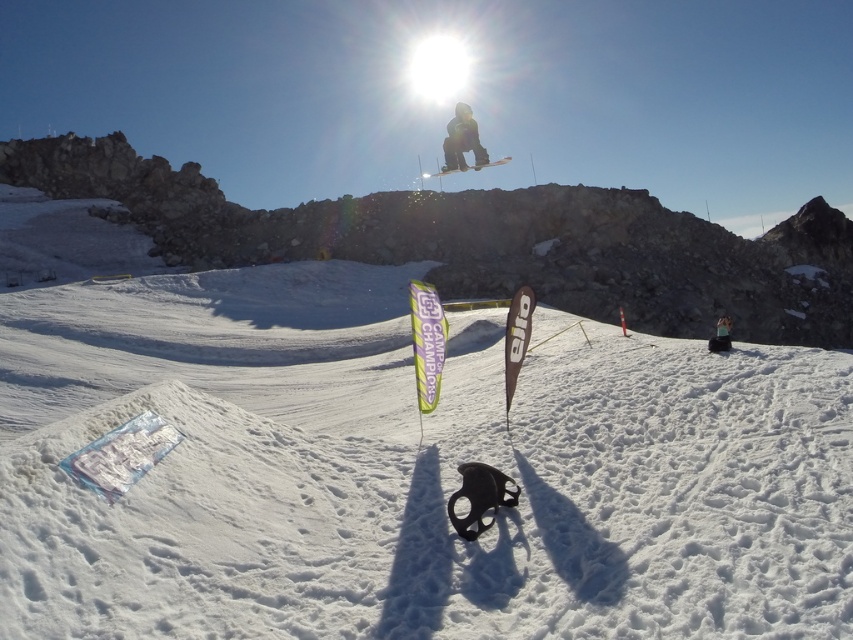
You are a photographer at the snowboarding event. You need to capture a photo that includes both the black matte snowboarder at center and the smooth black snowboarder at center. Given their sizes, which one should you focus on to ensure both fit in the frame without cropping?

Since the black matte snowboarder at center occupies less space than the smooth black snowboarder at center, you should focus on the smooth black snowboarder at center to ensure both fit in the frame without cropping.

You are a photographer positioned at the edge of the snowy slope. You notice two snowboarders labeled as the black matte snowboarder at center and the smooth black snowboarder at center. Which one would appear closer to you when taking a photo from your current position?

The black matte snowboarder at center appears closer because the smooth black snowboarder at center is positioned behind it.